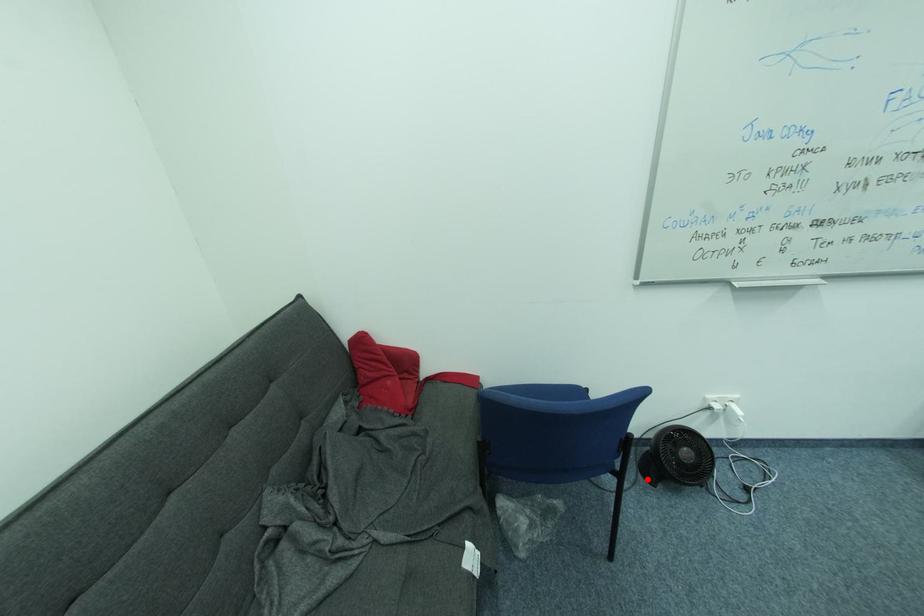
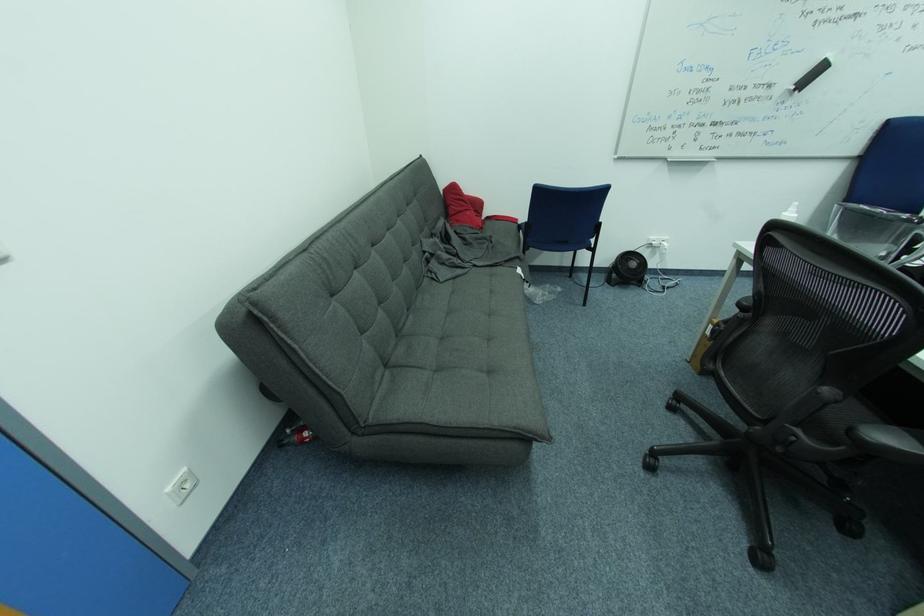
Where in the second image is the point corresponding to the highlighted location from the first image?

(613, 285)